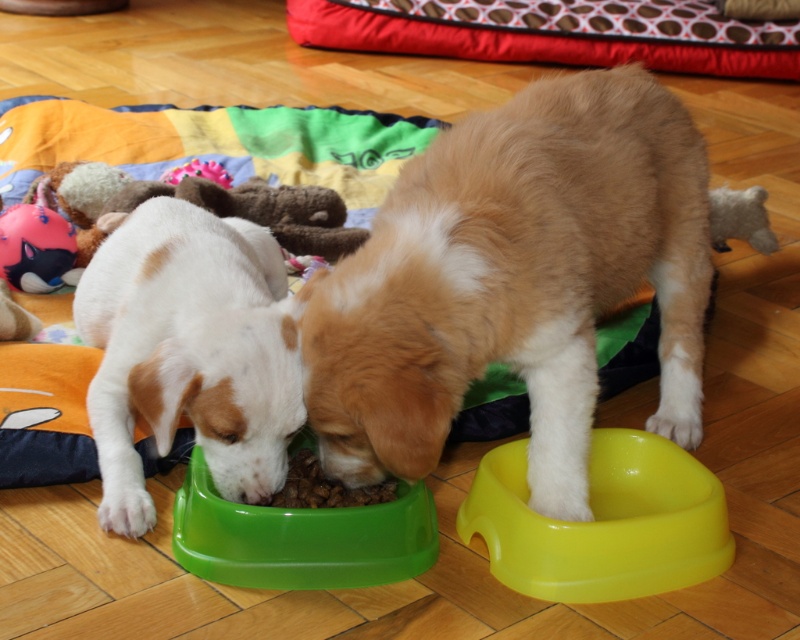
Question: Does golden fur dog at center appear on the left side of yellow plastic bowl at lower right?

Choices:
 (A) no
 (B) yes

Answer: (B)

Question: Does golden fur dog at center have a lesser width compared to matte pink plush toy at left?

Choices:
 (A) no
 (B) yes

Answer: (A)

Question: Which object appears closest to the camera in this image?

Choices:
 (A) brown matte food at center
 (B) matte pink plush toy at left

Answer: (A)

Question: Which object appears farthest from the camera in this image?

Choices:
 (A) green plastic bowl at lower left
 (B) yellow plastic bowl at lower right

Answer: (A)

Question: Does white matte dog at lower left have a smaller size compared to pink fabric toy at upper center?

Choices:
 (A) yes
 (B) no

Answer: (B)

Question: Which object appears farthest from the camera in this image?

Choices:
 (A) brown matte food at center
 (B) matte pink plush toy at left

Answer: (B)